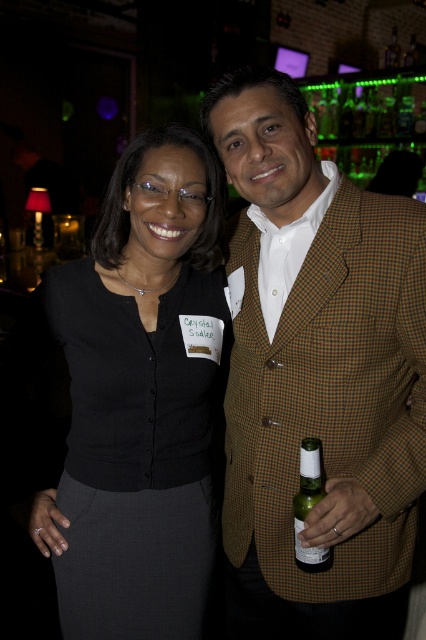
Is point (149, 378) farther from camera compared to point (302, 525)?

Yes, it is.

Can you confirm if black fabric skirt at center is wider than green glass bottle at center?

Indeed, black fabric skirt at center has a greater width compared to green glass bottle at center.

What do you see at coordinates (140, 397) in the screenshot? I see `black fabric skirt at center` at bounding box center [140, 397].

The height and width of the screenshot is (640, 426). Find the location of `black fabric skirt at center`. black fabric skirt at center is located at coordinates (140, 397).

Is brown checkered blazer at center shorter than black fabric skirt at center?

No.

From the picture: Between brown checkered blazer at center and black fabric skirt at center, which one appears on the right side from the viewer's perspective?

brown checkered blazer at center

The image size is (426, 640). I want to click on brown checkered blazer at center, so (x=317, y=376).

The image size is (426, 640). I want to click on brown checkered blazer at center, so click(x=317, y=376).

Between brown checkered blazer at center and green glass bottle at center, which one is positioned higher?

brown checkered blazer at center

Locate an element on the screen. This screenshot has height=640, width=426. brown checkered blazer at center is located at coordinates (317, 376).